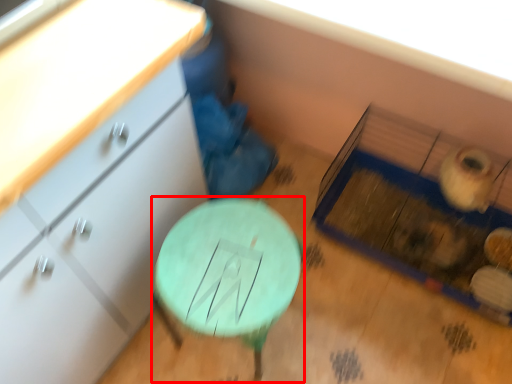
Question: From the image's perspective, where is table (annotated by the red box) located in relation to chest of drawers in the image?

Choices:
 (A) above
 (B) below

Answer: (B)